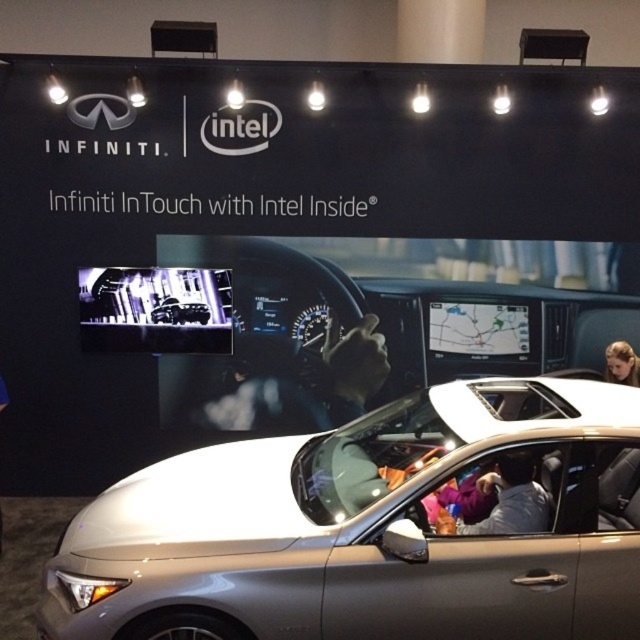
Can you confirm if gray fabric jacket at center is positioned to the left of blonde hair at upper right?

Correct, you'll find gray fabric jacket at center to the left of blonde hair at upper right.

Does gray fabric jacket at center lie behind blonde hair at upper right?

No, gray fabric jacket at center is closer to the viewer.

Describe the element at coordinates (509, 499) in the screenshot. This screenshot has height=640, width=640. I see `gray fabric jacket at center` at that location.

This screenshot has height=640, width=640. Identify the location of gray fabric jacket at center. (509, 499).

Is satin silver car at center smaller than blonde hair at upper right?

No, satin silver car at center is not smaller than blonde hair at upper right.

Which is in front, point (186, 550) or point (609, 365)?

Point (186, 550) is in front.

Is point (211, 572) positioned before point (611, 358)?

That is True.

Where is `satin silver car at center`? satin silver car at center is located at coordinates (372, 529).

Between point (76, 540) and point (538, 516), which one is positioned behind?

The point (76, 540) is behind.

Between satin silver car at center and gray fabric jacket at center, which one appears on the left side from the viewer's perspective?

satin silver car at center is more to the left.

This screenshot has height=640, width=640. Describe the element at coordinates (372, 529) in the screenshot. I see `satin silver car at center` at that location.

Where is `satin silver car at center`? satin silver car at center is located at coordinates (372, 529).